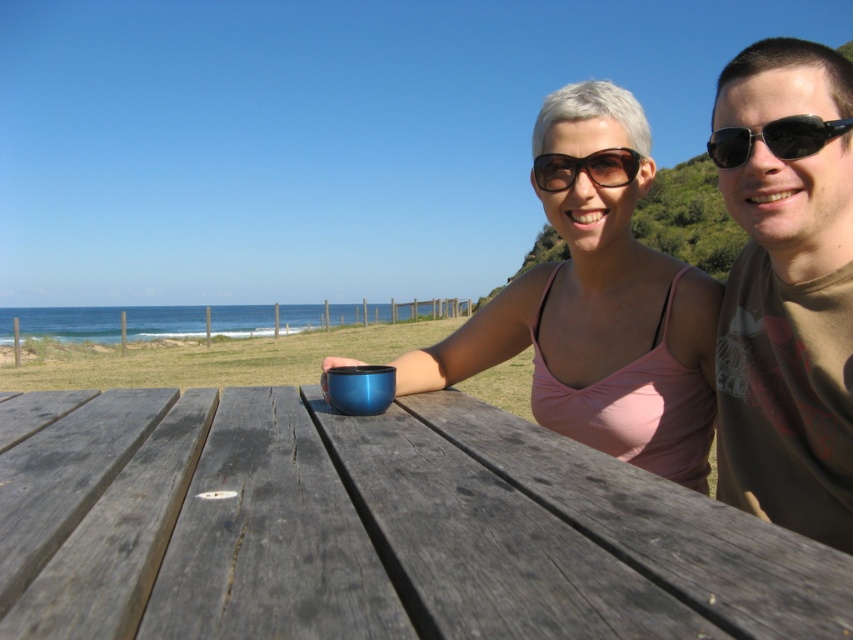
Question: Estimate the real-world distances between objects in this image. Which object is farther from the black plastic sunglasses at upper right?

Choices:
 (A) wooden picnic table at center
 (B) black plastic sunglasses at upper center
 (C) brown cotton t-shirt at upper right
 (D) glossy metallic mug at center

Answer: (A)

Question: Among these points, which one is farthest from the camera?

Choices:
 (A) (604, 177)
 (B) (676, 394)

Answer: (A)

Question: Considering the relative positions of wooden picnic table at center and black plastic sunglasses at upper center in the image provided, where is wooden picnic table at center located with respect to black plastic sunglasses at upper center?

Choices:
 (A) below
 (B) above

Answer: (A)

Question: Is wooden picnic table at center bigger than black plastic sunglasses at upper center?

Choices:
 (A) yes
 (B) no

Answer: (A)

Question: Is wooden picnic table at center smaller than black plastic sunglasses at upper right?

Choices:
 (A) no
 (B) yes

Answer: (A)

Question: Which point is farther from the camera taking this photo?

Choices:
 (A) (585, 346)
 (B) (102, 419)
 (C) (815, 193)
 (D) (732, 141)

Answer: (A)